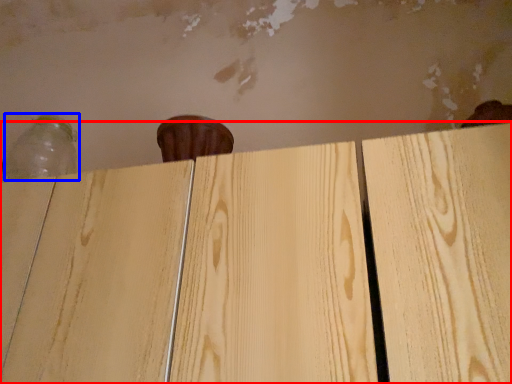
Question: Which point is further to the camera, plywood (highlighted by a red box) or bottle (highlighted by a blue box)?

Choices:
 (A) plywood
 (B) bottle

Answer: (B)